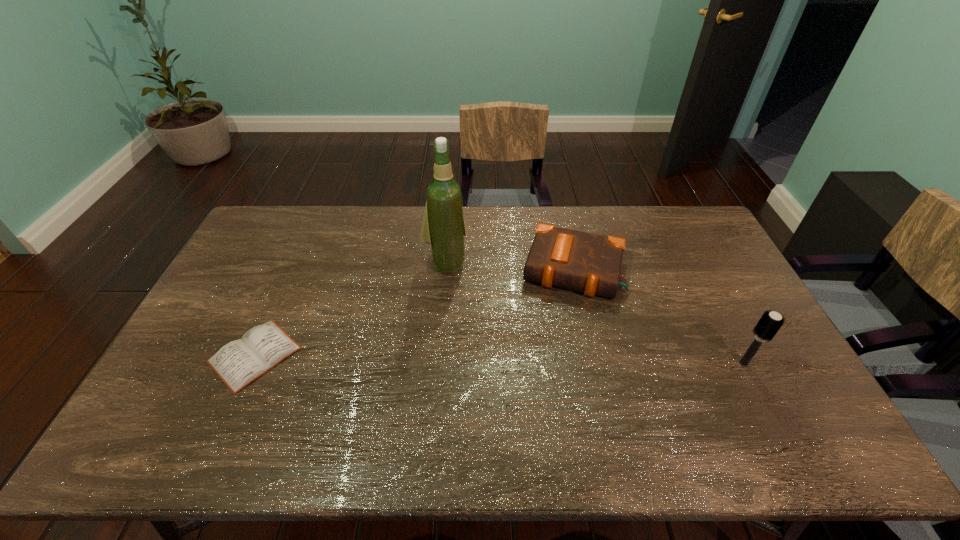
Locate an element on the screen. The width and height of the screenshot is (960, 540). free space located on the front-facing side of the second object from left to right is located at coordinates (455, 292).

Identify the location of vacant space located on the front-facing side of the second object from left to right. (464, 320).

Image resolution: width=960 pixels, height=540 pixels. Identify the location of free spot located 0.370m on the front-facing side of the second object from left to right. (479, 369).

This screenshot has height=540, width=960. I want to click on blank space located 0.190m on the spine side of the third tallest object, so click(x=552, y=350).

The height and width of the screenshot is (540, 960). I want to click on vacant region located on the spine side of the third tallest object, so click(555, 340).

I want to click on free region located 0.150m on the spine side of the third tallest object, so click(x=555, y=340).

Find the location of a particular element. object that is at the far edge is located at coordinates click(579, 261).

The width and height of the screenshot is (960, 540). Find the location of `object located in the near edge section of the desktop`. object located in the near edge section of the desktop is located at coordinates (238, 363).

The width and height of the screenshot is (960, 540). I want to click on object that is at the left edge, so click(x=238, y=363).

The image size is (960, 540). Find the location of `object that is positioned at the right edge`. object that is positioned at the right edge is located at coordinates (769, 324).